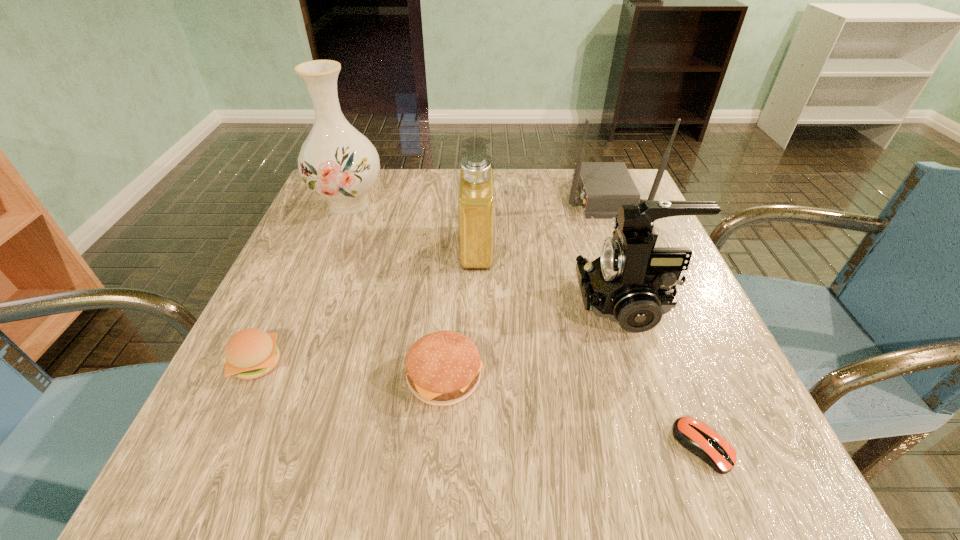
Locate an element on the screen. The height and width of the screenshot is (540, 960). vase is located at coordinates (337, 162).

Find the location of a particular element. This screenshot has height=540, width=960. perfume is located at coordinates (476, 193).

Where is `router`? router is located at coordinates (602, 187).

The image size is (960, 540). Find the location of `the fourth nearest object`. the fourth nearest object is located at coordinates (631, 282).

At what (x,y) coordinates should I click in order to perform the action: click on the right hamburger. Please return your answer as a coordinate pair (x, y). This screenshot has height=540, width=960. Looking at the image, I should click on (443, 368).

You are a GUI agent. You are given a task and a screenshot of the screen. Output one action in this format:
    pyautogui.click(x=<x>, y=<y>)
    Task: Click on the left hamburger
    The width and height of the screenshot is (960, 540).
    Given the screenshot: What is the action you would take?
    pyautogui.click(x=251, y=353)

You are a GUI agent. You are given a task and a screenshot of the screen. Output one action in this format:
    pyautogui.click(x=<x>, y=<y>)
    Task: Click on the shortest object
    The width and height of the screenshot is (960, 540).
    Given the screenshot: What is the action you would take?
    coord(694,435)

In order to click on computer mouse in this screenshot , I will do `click(694, 435)`.

Locate an element on the screen. blank space located on the right of the tallest object is located at coordinates (456, 204).

Locate an element on the screen. Image resolution: width=960 pixels, height=540 pixels. free space located on the front-facing side of the perfume is located at coordinates (653, 247).